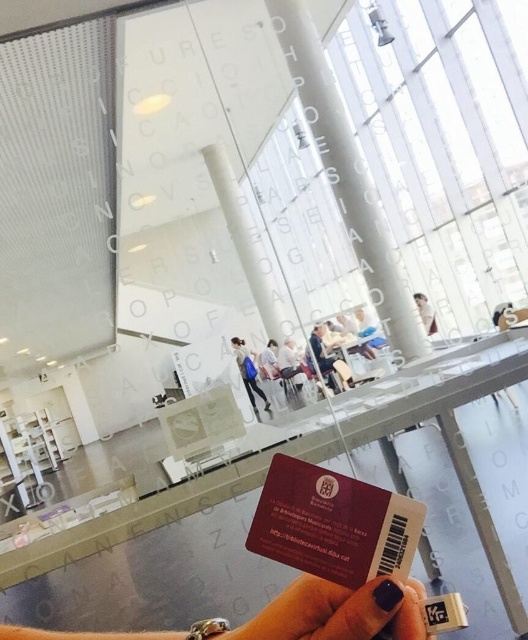
You are standing in the library and see a white fabric dress at center and a light blue fabric chair at center. Which object is positioned to the left when viewed from your perspective?

The white fabric dress at center is to the left of the light blue fabric chair at center.

You are a librarian trying to determine the relative positions of two items in the scene. You see a maroon plastic card at center and a white fabric shirt at upper center. Which object is positioned to the left of the other?

The maroon plastic card at center is to the left of white fabric shirt at upper center.

You are a visitor at this library and need to locate your library card. According to the image, where exactly is the maroon plastic card at center located in terms of coordinates?

The maroon plastic card at center is located at coordinates point (334,524).